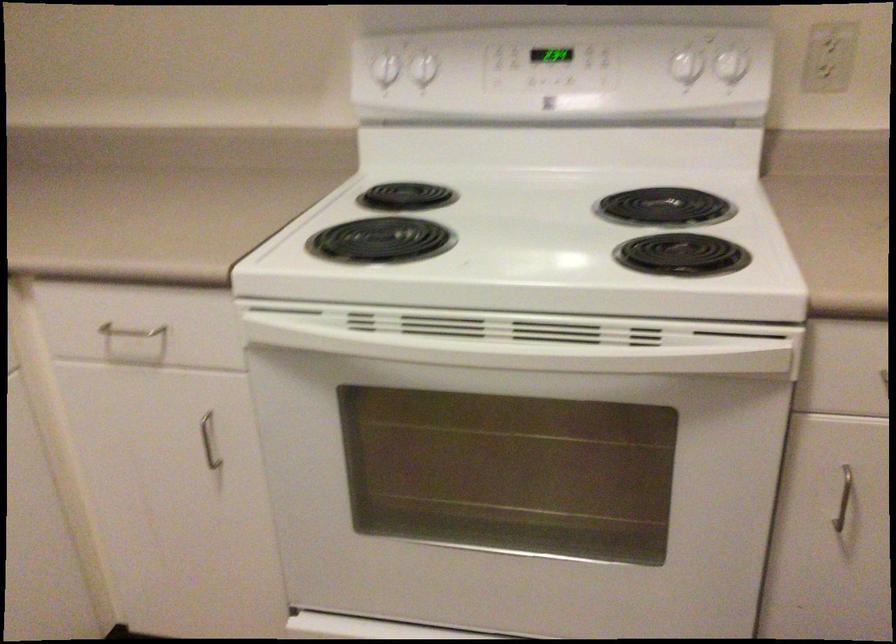
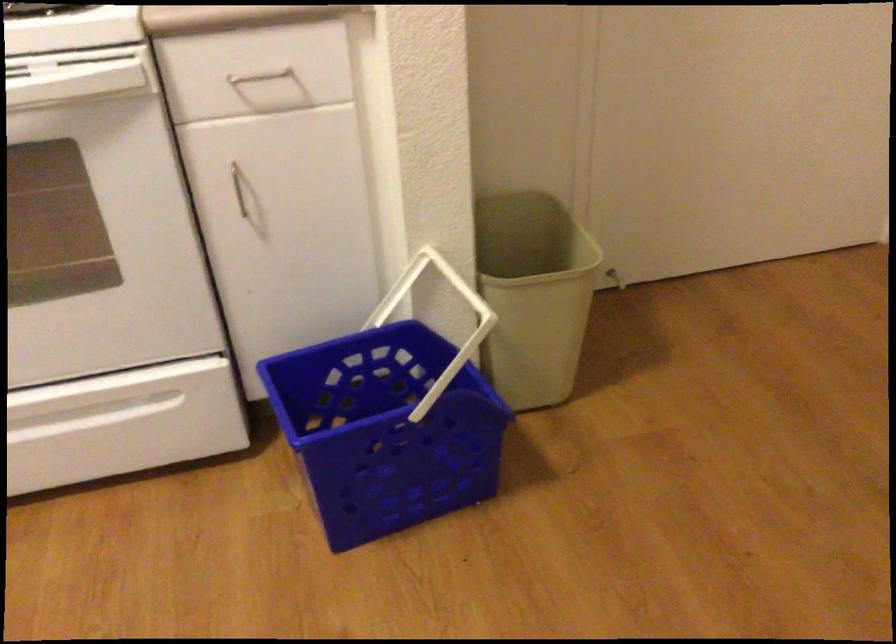
Question: Based on the continuous images, in which direction is the camera rotating? Reply with the corresponding letter.

Choices:
 (A) Left
 (B) Right
 (C) Up
 (D) Down

Answer: (B)